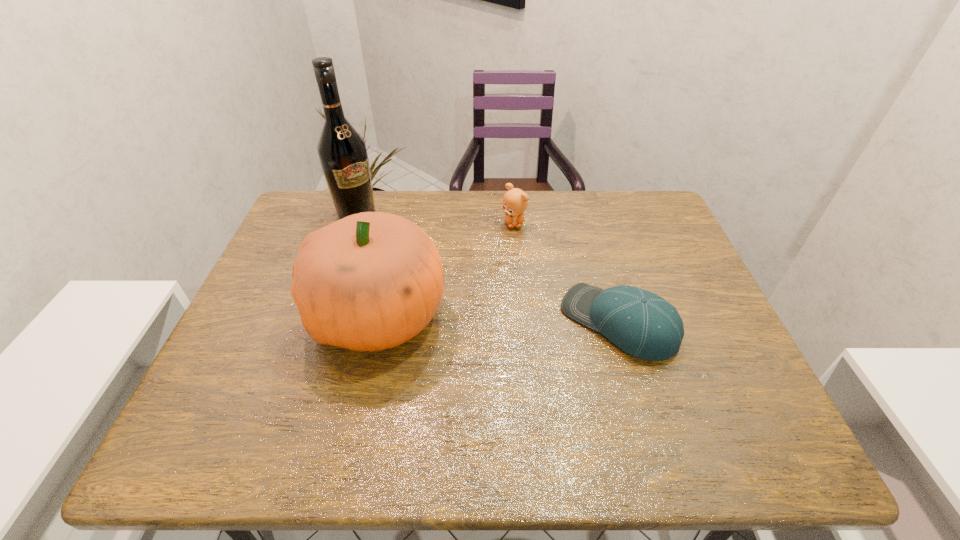
Find the location of `vacant position located on the label of the wine bottle`. vacant position located on the label of the wine bottle is located at coordinates (408, 262).

I want to click on vacant space located on the label of the wine bottle, so click(x=406, y=260).

The width and height of the screenshot is (960, 540). In order to click on vacant space located on the face of the second object from right to left in this screenshot , I will do `click(517, 260)`.

Find the location of `free region located on the face of the second object from right to left`. free region located on the face of the second object from right to left is located at coordinates (523, 308).

Identify the location of vacant region located 0.290m on the face of the second object from right to left. The image size is (960, 540). (522, 302).

Where is `wine bottle at the far edge`? The width and height of the screenshot is (960, 540). wine bottle at the far edge is located at coordinates (342, 151).

In order to click on teddy bear that is at the far edge in this screenshot , I will do `click(515, 201)`.

This screenshot has height=540, width=960. Find the location of `object at the left edge`. object at the left edge is located at coordinates (342, 151).

Where is `object positioned at the right edge`? object positioned at the right edge is located at coordinates (644, 325).

Where is `object present at the far left corner`? This screenshot has height=540, width=960. object present at the far left corner is located at coordinates (342, 151).